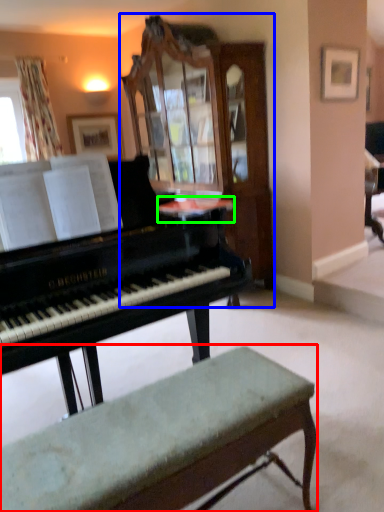
Question: Based on their relative distances, which object is farther from bench (highlighted by a red box)? Choose from cabinetry (highlighted by a blue box) and table (highlighted by a green box).

Choices:
 (A) cabinetry
 (B) table

Answer: (A)